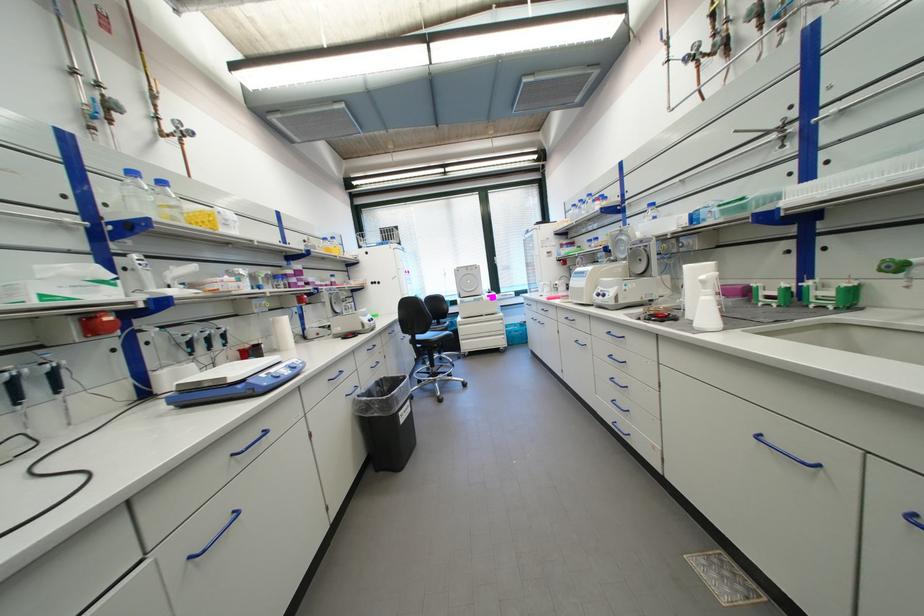
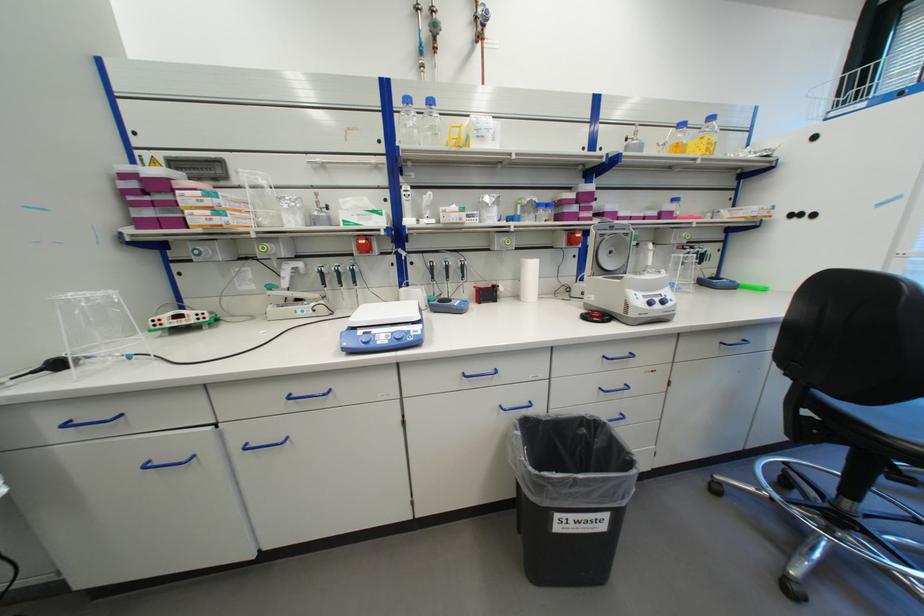
In the second image, find the point that corresponds to (x=407, y=415) in the first image.

(565, 517)